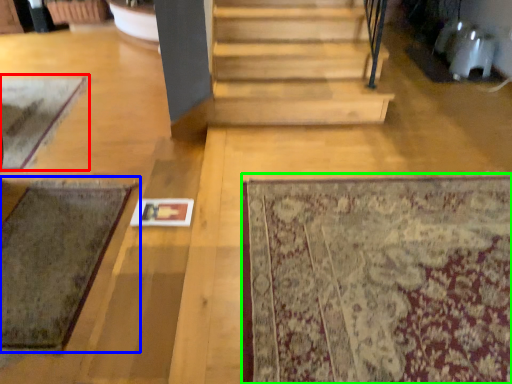
Question: Considering the real-world distances, which object is closest to mat (highlighted by a red box)? mat (highlighted by a blue box) or mat (highlighted by a green box).

Choices:
 (A) mat
 (B) mat

Answer: (A)